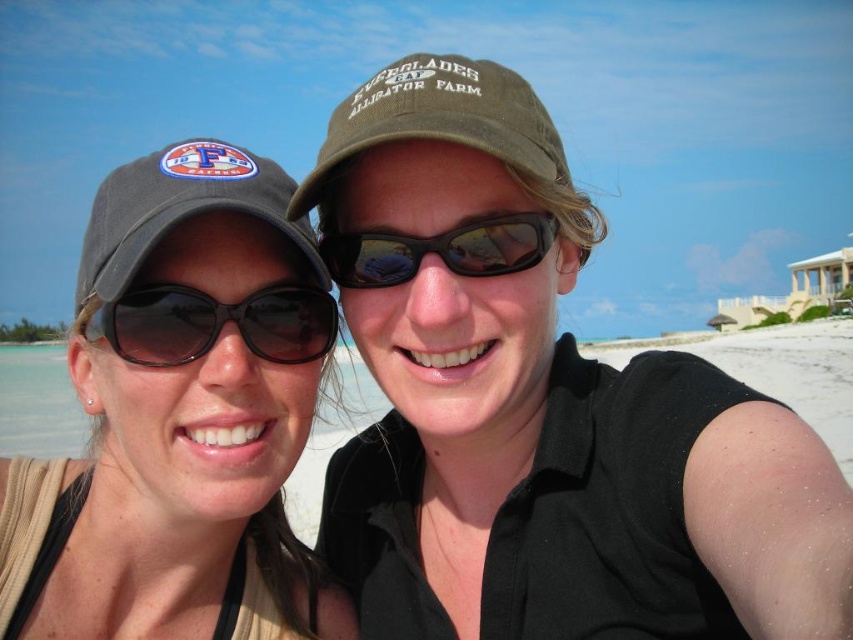
Consider the image. Which of these two, matte gray baseball cap at left or black matte sunglasses at center, stands shorter?

With less height is black matte sunglasses at center.

This screenshot has width=853, height=640. In order to click on matte gray baseball cap at left in this screenshot , I will do `click(178, 209)`.

At what (x,y) coordinates should I click in order to perform the action: click on matte gray baseball cap at left. Please return your answer as a coordinate pair (x, y). Looking at the image, I should click on (178, 209).

Find the location of a particular element. matte gray cap at upper left is located at coordinates (180, 417).

From the picture: Between matte gray cap at upper left and green fabric cap at upper center, which one has less height?

green fabric cap at upper center is shorter.

Is point (218, 360) positioned before point (376, 120)?

No, (218, 360) is further to viewer.

Locate an element on the screen. Image resolution: width=853 pixels, height=640 pixels. matte gray cap at upper left is located at coordinates (180, 417).

Locate an element on the screen. The width and height of the screenshot is (853, 640). matte green cap at upper center is located at coordinates (538, 404).

Is point (415, 216) in front of point (122, 208)?

No, (415, 216) is behind (122, 208).

Identify the location of matte green cap at upper center. This screenshot has width=853, height=640. (538, 404).